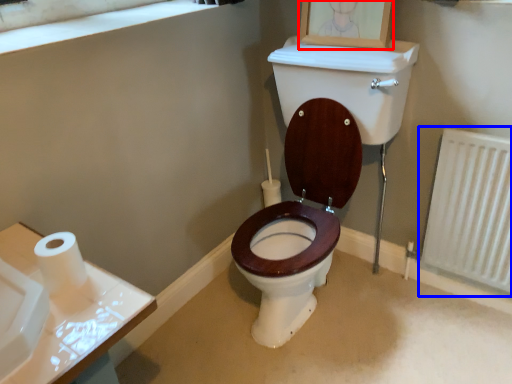
Question: Which object appears farthest to the camera in this image, picture frame (highlighted by a red box) or radiator (highlighted by a blue box)?

Choices:
 (A) picture frame
 (B) radiator

Answer: (A)